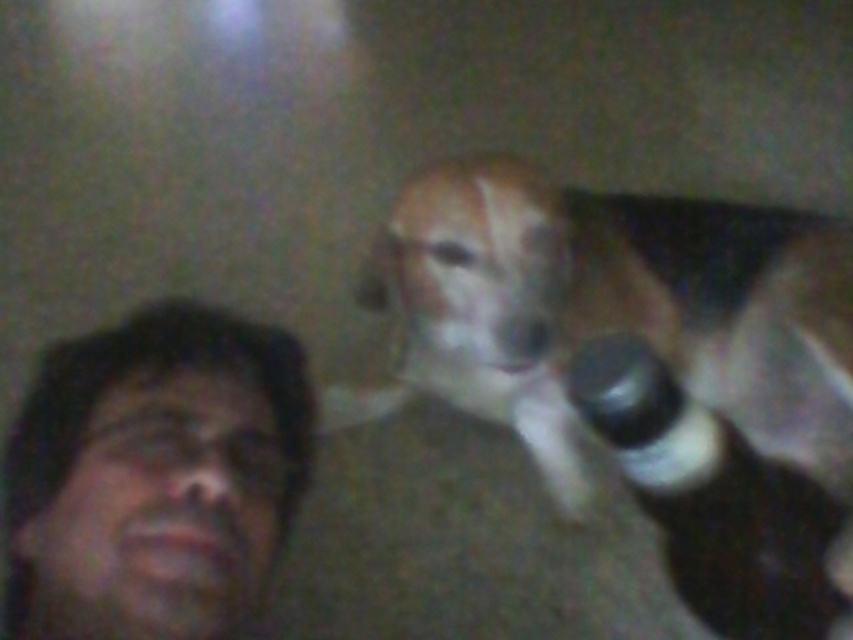
Question: Can you confirm if brown fur dog at upper right is positioned above black plastic bottle at upper right?

Choices:
 (A) yes
 (B) no

Answer: (A)

Question: Which of these objects is positioned closest to the black plastic bottle at upper right?

Choices:
 (A) matte black hair at left
 (B) brown fur dog at upper right

Answer: (B)

Question: Among these points, which one is farthest from the camera?

Choices:
 (A) (635, 365)
 (B) (241, 372)
 (C) (769, 566)

Answer: (C)

Question: Which point is farther from the camera taking this photo?

Choices:
 (A) (697, 516)
 (B) (747, 582)

Answer: (B)

Question: Can you confirm if brown fur dog at upper right is bigger than matte black hair at left?

Choices:
 (A) no
 (B) yes

Answer: (B)

Question: Can you confirm if brown fur dog at upper right is smaller than matte black hair at left?

Choices:
 (A) no
 (B) yes

Answer: (A)